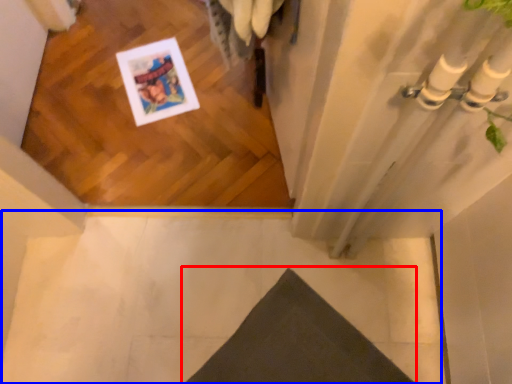
Question: Among these objects, which one is nearest to the camera, doormat (highlighted by a red box) or concrete (highlighted by a blue box)?

Choices:
 (A) doormat
 (B) concrete

Answer: (A)